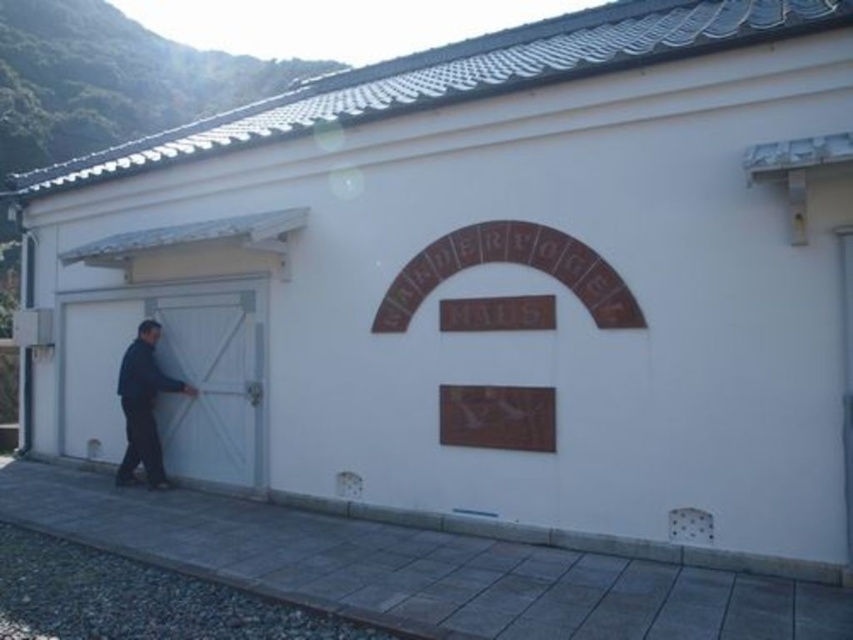
From the picture: Can you confirm if white matte garage door at left is wider than dark blue fabric at left?

Yes.

Which is behind, point (77, 442) or point (149, 387)?

The point (77, 442) is more distant.

Locate an element on the screen. white matte garage door at left is located at coordinates (173, 376).